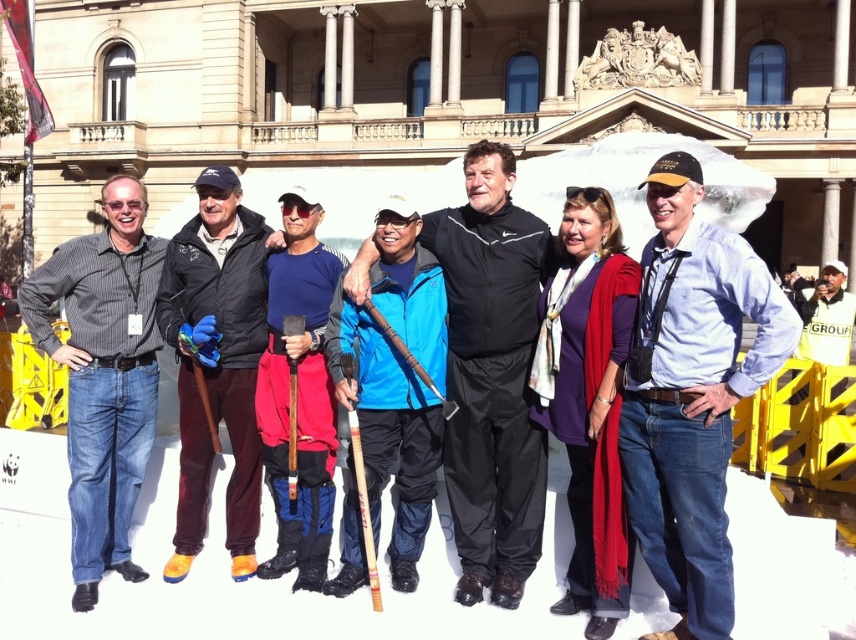
Question: Which point appears closest to the camera in this image?

Choices:
 (A) (236, 548)
 (B) (306, 380)

Answer: (A)

Question: Estimate the real-world distances between objects in this image. Which object is farther from the blue denim jeans at right?

Choices:
 (A) dark brown leather jacket at center
 (B) blue softshell jacket at center
 (C) blue fabric shirt at center

Answer: (A)

Question: Is blue softshell jacket at center further to the viewer compared to striped cotton shirt at left?

Choices:
 (A) no
 (B) yes

Answer: (A)

Question: Which object is positioned farthest from the dark brown leather jacket at center?

Choices:
 (A) blue fabric shirt at center
 (B) blue softshell jacket at center

Answer: (B)

Question: Can you confirm if blue softshell jacket at center is positioned above dark brown leather jacket at center?

Choices:
 (A) no
 (B) yes

Answer: (A)

Question: Where is blue denim jeans at right located in relation to blue fabric shirt at center in the image?

Choices:
 (A) below
 (B) above

Answer: (B)